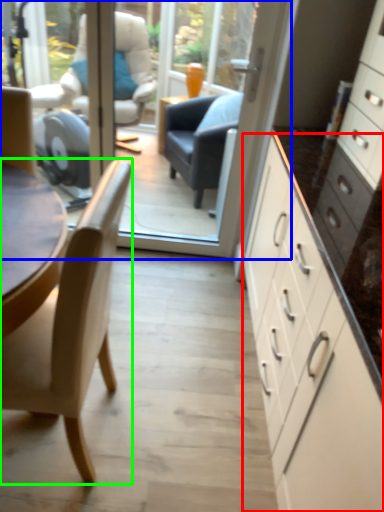
Question: Estimate the real-world distances between objects in this image. Which object is closer to cabinetry (highlighted by a red box), glass door (highlighted by a blue box) or chair (highlighted by a green box)?

Choices:
 (A) glass door
 (B) chair

Answer: (B)